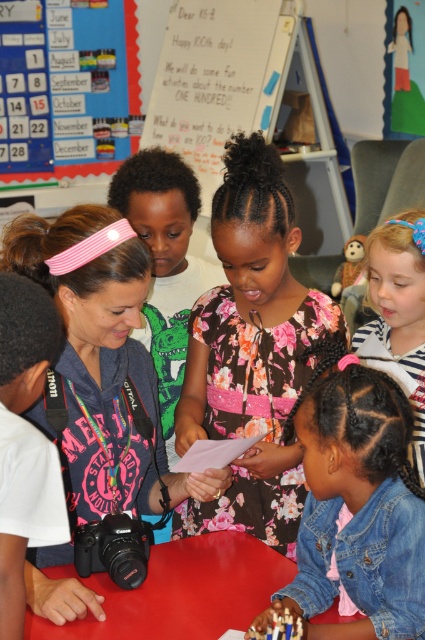
Is point (277, 305) farther from viewer compared to point (68, 573)?

Yes.

Looking at this image, which is more to the right, floral fabric dress at center or red plastic table at lower center?

floral fabric dress at center

Locate an element on the screen. The height and width of the screenshot is (640, 425). floral fabric dress at center is located at coordinates (252, 352).

Locate an element on the screen. The width and height of the screenshot is (425, 640). floral fabric dress at center is located at coordinates (252, 352).

Is blue paper calendar at upper left thinner than blue striped shirt at lower right?

In fact, blue paper calendar at upper left might be wider than blue striped shirt at lower right.

Identify the location of blue paper calendar at upper left. (70, 92).

Is point (133, 422) positioned after point (401, 221)?

No, it is not.

Who is more forward, (37, 220) or (410, 292)?

Positioned in front is point (37, 220).

Who is more forward, [42,218] or [419,388]?

Point [42,218] is in front.

At what (x,y) coordinates should I click in order to perform the action: click on pink fabric headband at center. Please return your answer as a coordinate pair (x, y). Looking at the image, I should click on (102, 365).